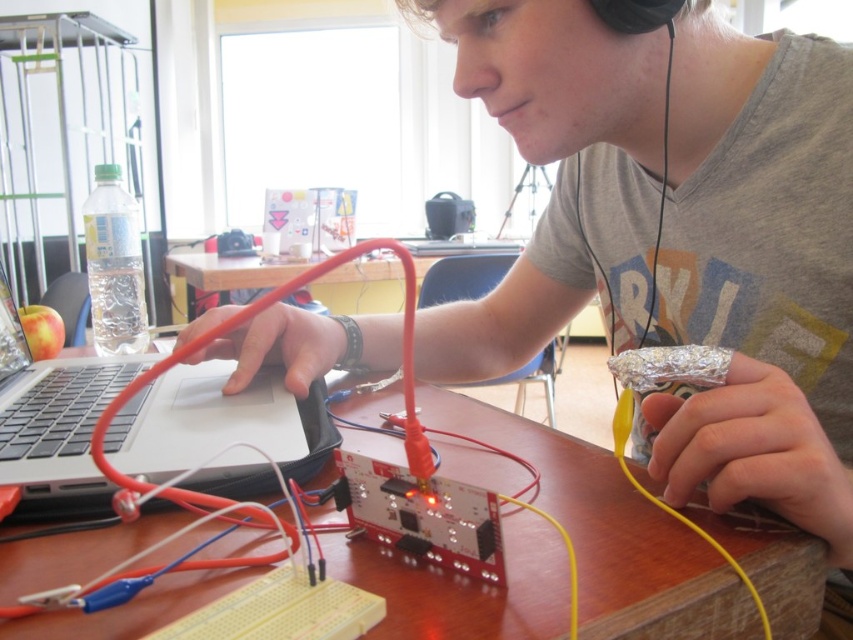
You are a photographer aiming to capture the person working on the electronics project. Since the matte gray shirt at center and wooden table at center are both in the frame, which object will appear larger in the photo?

The matte gray shirt at center will appear larger in the photo because it has a greater height compared to the wooden table at center.

You are a robot trying to reach two points on a desk. The first point is at point (747,632) and the second point is at point (241,264). According to the scene, which point is closer to you?

Point (747,632) is in front of point (241,264), so the first point is closer to you.